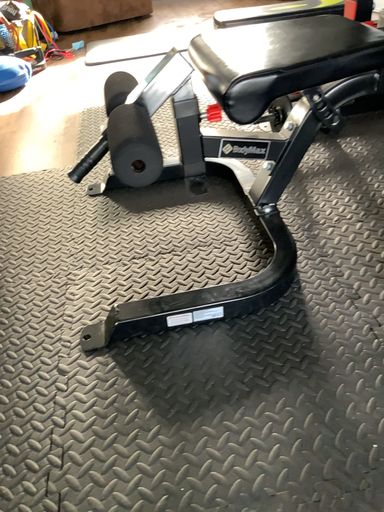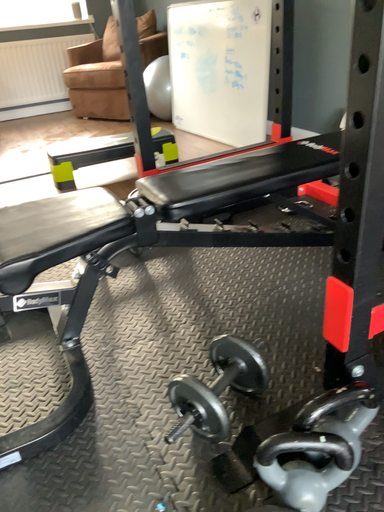
Question: Which way did the camera rotate in the video?

Choices:
 (A) rotated downward
 (B) rotated upward

Answer: (B)